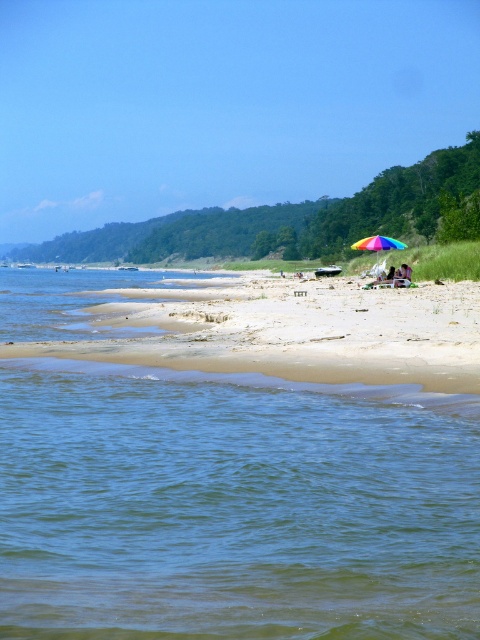
Question: Does sandy beach at center appear under rainbow fabric umbrella at center?

Choices:
 (A) no
 (B) yes

Answer: (B)

Question: Which object is the closest to the sandy beach at center?

Choices:
 (A) clear blue water at lower left
 (B) rainbow fabric umbrella at center

Answer: (A)

Question: Is clear blue water at lower left below rainbow fabric umbrella at center?

Choices:
 (A) no
 (B) yes

Answer: (B)

Question: Which of the following is the closest to the observer?

Choices:
 (A) sandy beach at center
 (B) rainbow fabric umbrella at center
 (C) clear blue water at lower left

Answer: (C)

Question: Does sandy beach at center appear on the left side of rainbow fabric umbrella at center?

Choices:
 (A) no
 (B) yes

Answer: (B)

Question: Which point is farther from the camera taking this photo?

Choices:
 (A) (421, 525)
 (B) (250, 330)

Answer: (B)